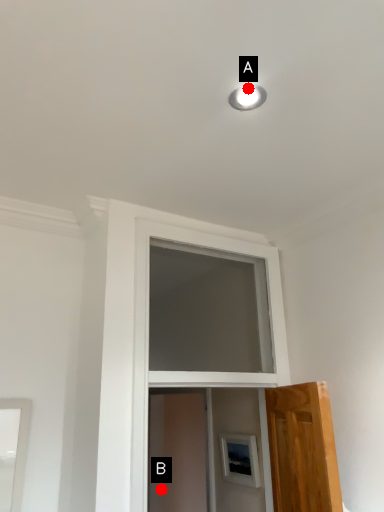
Question: Two points are circled on the image, labeled by A and B beside each circle. Which point is farther from the camera taking this photo?

Choices:
 (A) A is further
 (B) B is further

Answer: (B)